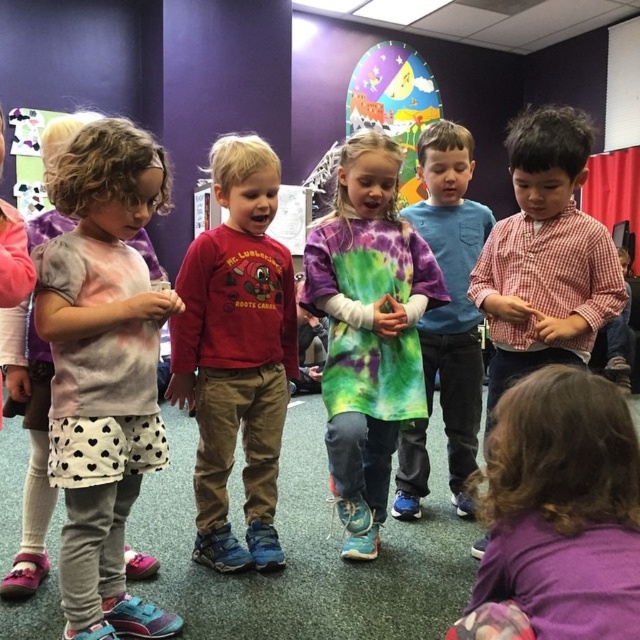
Is tie-dye fabric dress at center thinner than tie-dye shirt at center?

In fact, tie-dye fabric dress at center might be wider than tie-dye shirt at center.

Does tie-dye fabric dress at center have a larger size compared to tie-dye shirt at center?

Yes.

What are the coordinates of `tie-dye fabric dress at center` in the screenshot? It's located at (369, 330).

Who is positioned more to the right, red cotton shirt at center or tie-dye fabric dress at center?

Positioned to the right is tie-dye fabric dress at center.

Is point (225, 236) more distant than point (321, 310)?

No, it is in front of (321, 310).

Find the location of `red cotton shirt at center`. red cotton shirt at center is located at coordinates point(236,353).

Can you confirm if light pink tie-dye shirt at left is positioned above purple fabric shirt at lower right?

Yes.

I want to click on light pink tie-dye shirt at left, so click(x=104, y=365).

Locate an element on the screen. Image resolution: width=640 pixels, height=640 pixels. light pink tie-dye shirt at left is located at coordinates (104, 365).

Find the location of a particular element. The width and height of the screenshot is (640, 640). light pink tie-dye shirt at left is located at coordinates (104, 365).